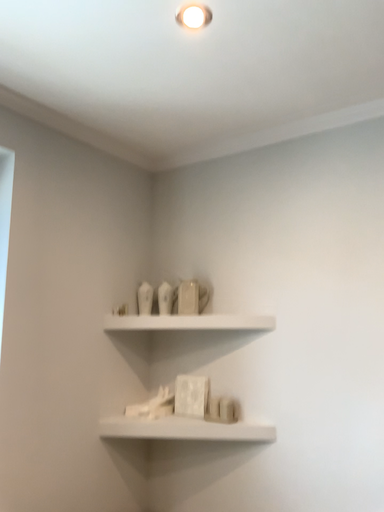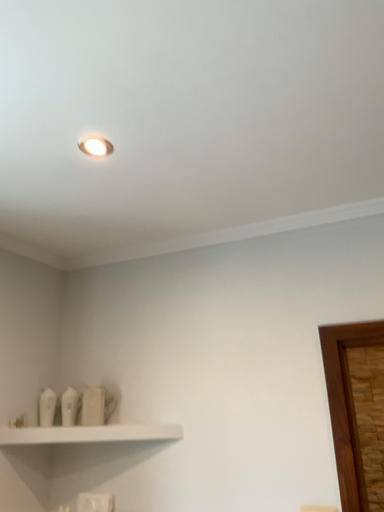
Question: Which way did the camera rotate in the video?

Choices:
 (A) rotated right
 (B) rotated left

Answer: (A)